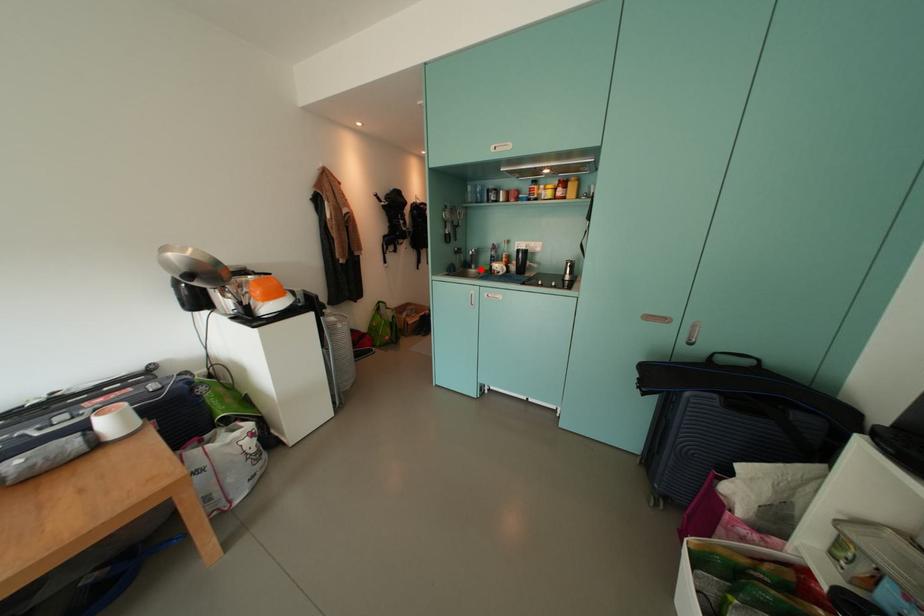
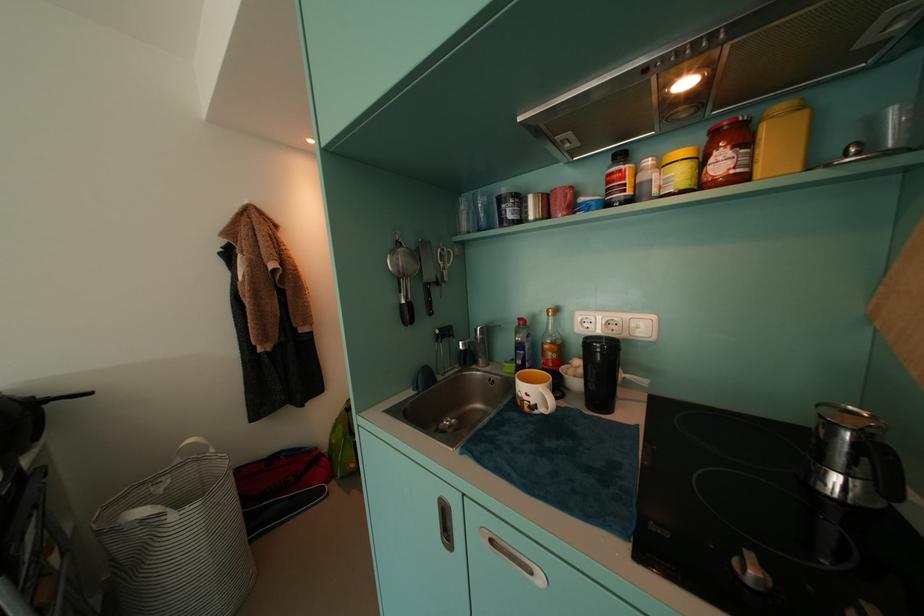
Find the pixel in the second image that matches the highlighted location in the first image.

(488, 363)